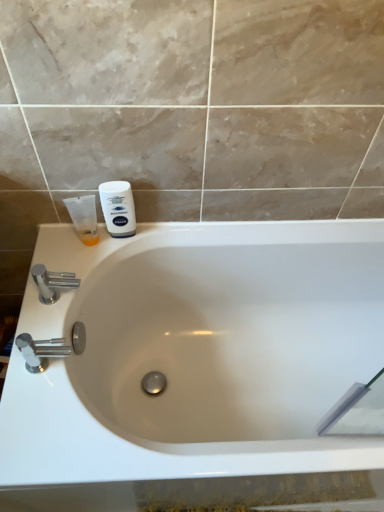
Question: From a real-world perspective, is translucent orange tube at left, which appears as the 1th shaving cream when viewed from the left, over polished chrome faucet at lower left, acting as the 2th tap starting from the top?

Choices:
 (A) no
 (B) yes

Answer: (B)

Question: Is translucent orange tube at left, which appears as the 1th shaving cream when viewed from the left, beside polished chrome faucet at lower left, marked as the first tap in a bottom-to-top arrangement?

Choices:
 (A) no
 (B) yes

Answer: (A)

Question: Can we say translucent orange tube at left, which appears as the 1th shaving cream when viewed from the left, lies outside polished chrome faucet at lower left, placed as the 2th tap when sorted from back to front?

Choices:
 (A) yes
 (B) no

Answer: (A)

Question: Would you say translucent orange tube at left, which appears as the 1th shaving cream when viewed from the left, is a long distance from polished chrome faucet at lower left, which appears as the first tap when viewed from the front?

Choices:
 (A) yes
 (B) no

Answer: (B)

Question: Could you tell me if translucent orange tube at left, which is the 2th shaving cream from right to left, is facing polished chrome faucet at lower left, placed as the 2th tap when sorted from back to front?

Choices:
 (A) yes
 (B) no

Answer: (A)

Question: Is chrome metallic faucet at left, the 1th tap in the top-to-bottom sequence, in front of or behind white matte shaving cream at upper left, the 2th shaving cream viewed from the left, in the image?

Choices:
 (A) behind
 (B) front

Answer: (B)

Question: Considering the positions of chrome metallic faucet at left, arranged as the 1th tap when viewed from the back, and white matte shaving cream at upper left, arranged as the first shaving cream when viewed from the right, in the image, is chrome metallic faucet at left, arranged as the 1th tap when viewed from the back, wider or thinner than white matte shaving cream at upper left, arranged as the first shaving cream when viewed from the right,?

Choices:
 (A) wide
 (B) thin

Answer: (A)

Question: In terms of size, does chrome metallic faucet at left, arranged as the 1th tap when viewed from the back, appear bigger or smaller than white matte shaving cream at upper left, the 2th shaving cream viewed from the left?

Choices:
 (A) big
 (B) small

Answer: (A)

Question: From a real-world perspective, relative to white matte shaving cream at upper left, the 2th shaving cream viewed from the left, is chrome metallic faucet at left, arranged as the 1th tap when viewed from the back, vertically above or below?

Choices:
 (A) above
 (B) below

Answer: (B)

Question: Is point (39, 280) closer or farther from the camera than point (352, 439)?

Choices:
 (A) closer
 (B) farther

Answer: (B)

Question: Choose the correct answer: Is chrome metallic faucet at left, the 1th tap in the top-to-bottom sequence, inside white glossy bathtub at center or outside it?

Choices:
 (A) inside
 (B) outside

Answer: (B)

Question: Looking at their shapes, would you say chrome metallic faucet at left, the 1th tap in the top-to-bottom sequence, is wider or thinner than white glossy bathtub at center?

Choices:
 (A) wide
 (B) thin

Answer: (B)

Question: Is chrome metallic faucet at left, arranged as the 1th tap when viewed from the back, to the left or to the right of white glossy bathtub at center in the image?

Choices:
 (A) left
 (B) right

Answer: (A)

Question: From a real-world perspective, is translucent orange tube at left, which appears as the 1th shaving cream when viewed from the left, physically located above or below white glossy bathtub at center?

Choices:
 (A) above
 (B) below

Answer: (A)

Question: From the image's perspective, is translucent orange tube at left, which appears as the 1th shaving cream when viewed from the left, located above or below white glossy bathtub at center?

Choices:
 (A) below
 (B) above

Answer: (B)